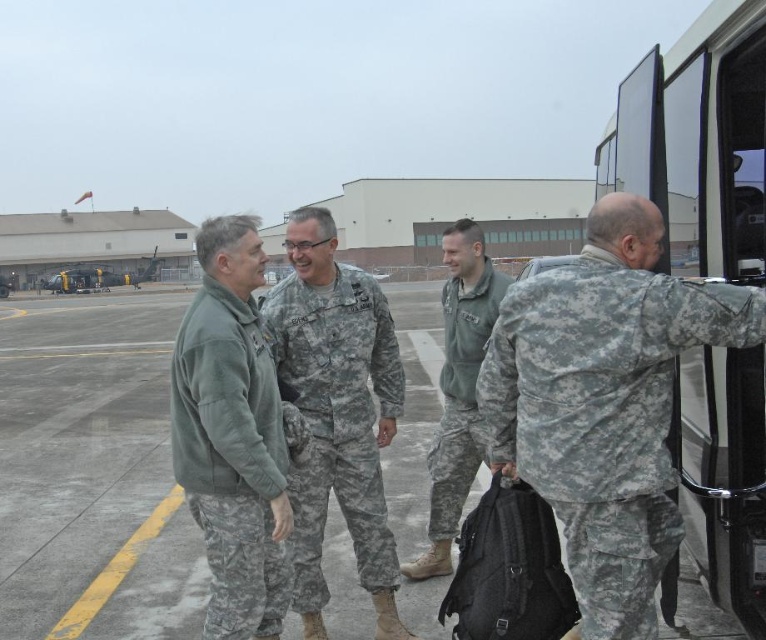
You are a GUI agent. You are given a task and a screenshot of the screen. Output one action in this format:
    pyautogui.click(x=<x>, y=<y>)
    Task: Click on the camouflage uniform at right
    
    Given the screenshot: What is the action you would take?
    pyautogui.click(x=604, y=403)

What do you see at coordinates (604, 403) in the screenshot? This screenshot has height=640, width=766. I see `camouflage uniform at right` at bounding box center [604, 403].

The image size is (766, 640). Find the location of `camouflage uniform at right`. camouflage uniform at right is located at coordinates click(604, 403).

Is green fleece jacket at left to the right of camouflage fabric uniform at center from the viewer's perspective?

No, green fleece jacket at left is not to the right of camouflage fabric uniform at center.

You are a GUI agent. You are given a task and a screenshot of the screen. Output one action in this format:
    pyautogui.click(x=<x>, y=<y>)
    Task: Click on the green fleece jacket at left
    The width and height of the screenshot is (766, 640).
    Given the screenshot: What is the action you would take?
    pyautogui.click(x=231, y=458)

Consider the image. Who is higher up, camouflage fabric tarmac at center or camouflage uniform at right?

Positioned higher is camouflage fabric tarmac at center.

Which is in front, point (56, 636) or point (476, 380)?

Point (476, 380) is in front.

Between point (103, 380) and point (496, 355), which one is positioned in front?

Point (496, 355)

Identify the location of camouflage fabric tarmac at center. (92, 474).